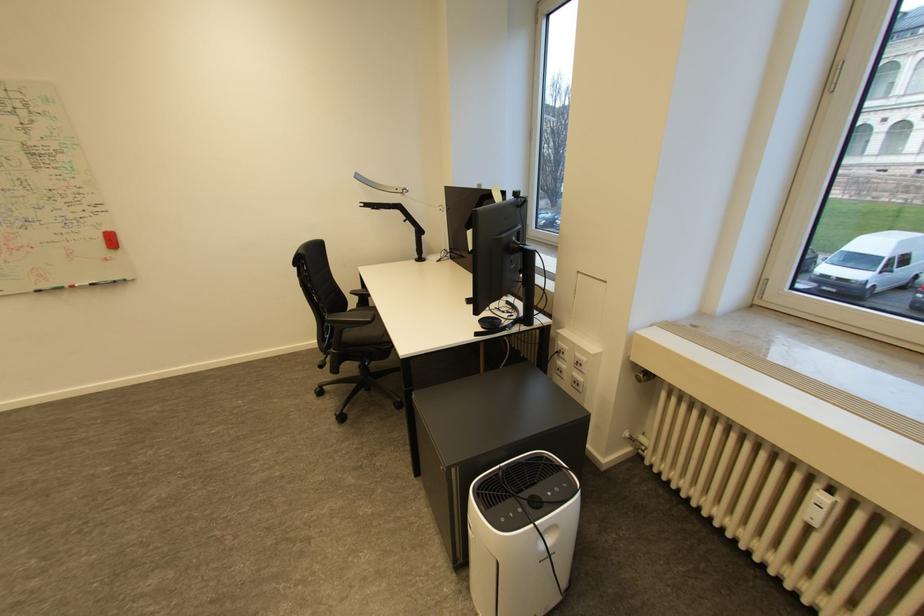
The image size is (924, 616). What do you see at coordinates (365, 331) in the screenshot?
I see `the chair sitting surface` at bounding box center [365, 331].